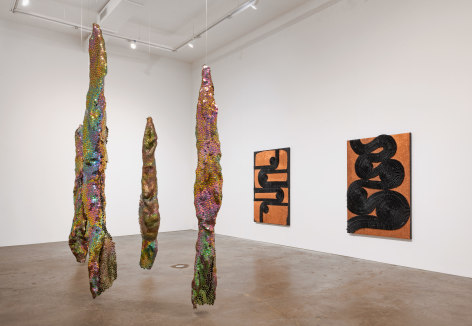
Identify the location of frame. Image resolution: width=472 pixels, height=326 pixels. (82, 30).